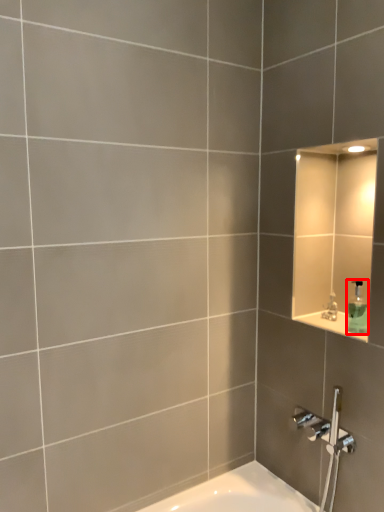
Question: From the image's perspective, where is soap dispenser (annotated by the red box) located in relation to faucet in the image?

Choices:
 (A) below
 (B) above

Answer: (B)